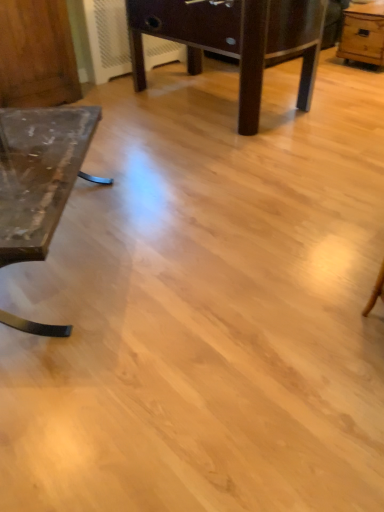
Question: From the image's perspective, relative to matte glass table at left, acting as the first table starting from the left, is wooden dresser at left above or below?

Choices:
 (A) below
 (B) above

Answer: (B)

Question: Relative to matte glass table at left, acting as the first table starting from the left, is wooden dresser at left in front or behind?

Choices:
 (A) behind
 (B) front

Answer: (A)

Question: Which object is positioned closest to the dark brown wooden table at center, the 2th table viewed from the left?

Choices:
 (A) light brown wooden table at upper right, arranged as the first table when viewed from the right
 (B) matte glass table at left, acting as the first table starting from the left
 (C) wooden dresser at left

Answer: (C)

Question: Considering the real-world distances, which object is closest to the light brown wooden table at upper right, arranged as the first table when viewed from the right?

Choices:
 (A) wooden dresser at left
 (B) matte glass table at left, acting as the first table starting from the left
 (C) dark brown wooden table at center, the 2th table viewed from the left

Answer: (C)